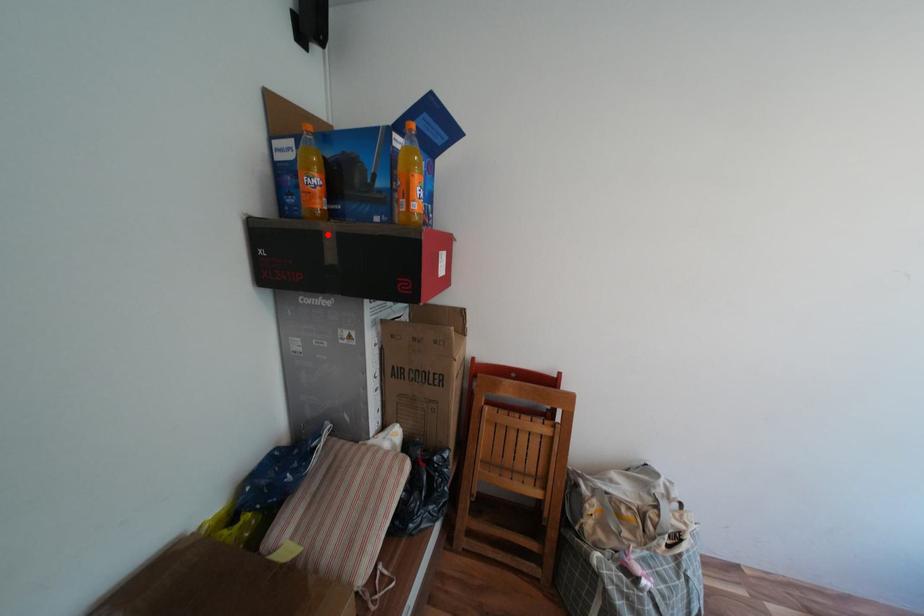
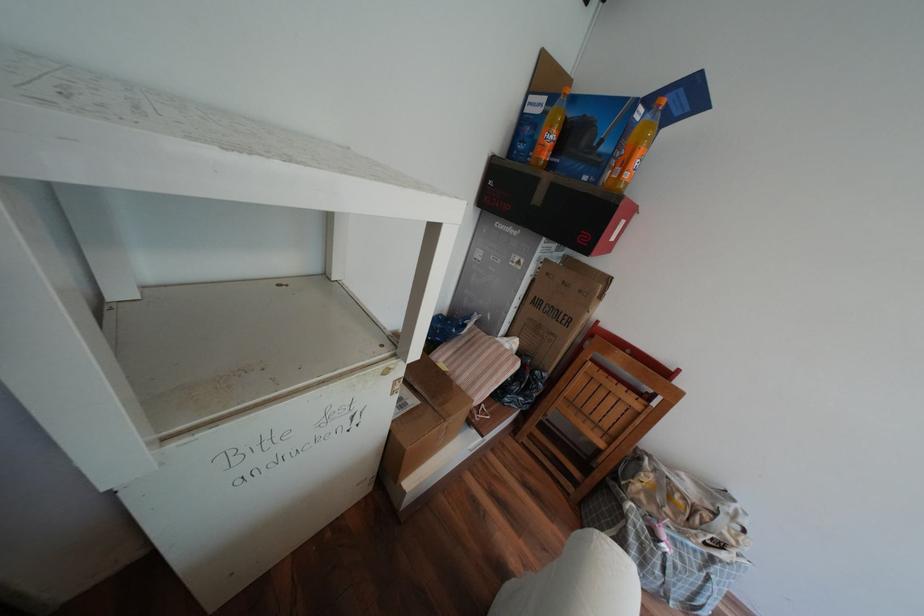
Where in the second image is the point corresponding to the highlighted location from the first image?

(545, 180)